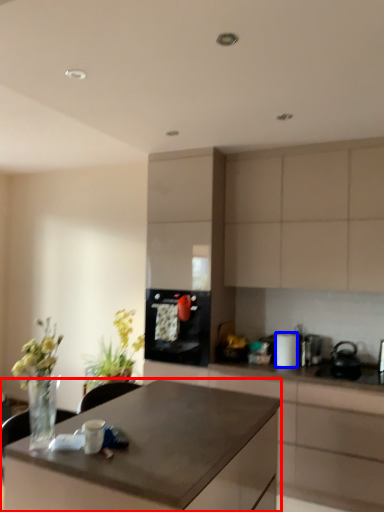
Question: Which point is further to the camera, desk (highlighted by a red box) or appliance (highlighted by a blue box)?

Choices:
 (A) desk
 (B) appliance

Answer: (B)